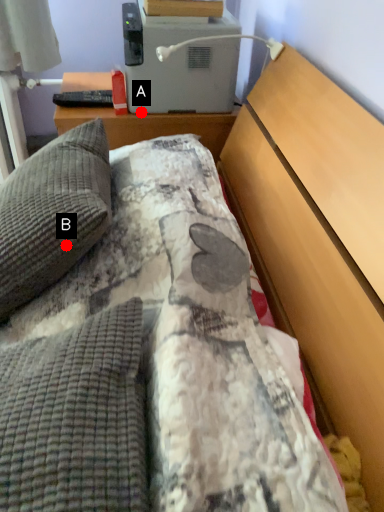
Question: Two points are circled on the image, labeled by A and B beside each circle. Which point is further to the camera?

Choices:
 (A) A is further
 (B) B is further

Answer: (A)